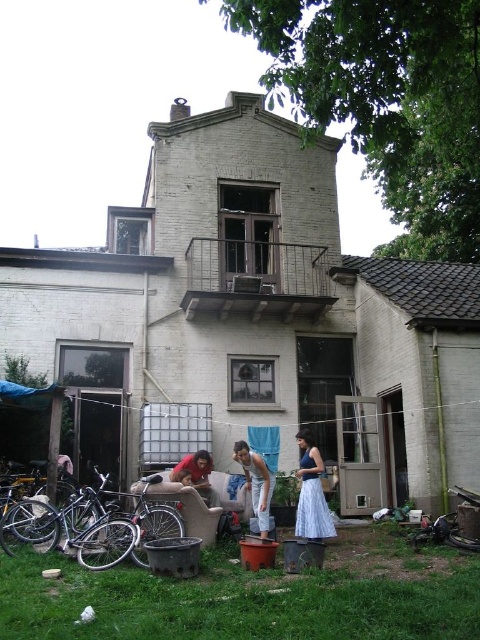
You are standing at the point with coordinates point (256, 467) and want to walk to the point with coordinates point (412, 566). Which direction should you move to reach your destination?

You should move forward because point (412, 566) is in front of point (256, 467).

You are a delivery person approaching the house and need to place a package between the matte brown pot at lower center and the white cotton tank top at center. Can you place it directly in between them?

The matte brown pot at lower center is in front of the white cotton tank top at center, so there is no space between them for the package. You would need to place the package either in front of the matte brown pot at lower center or behind the white cotton tank top at center.